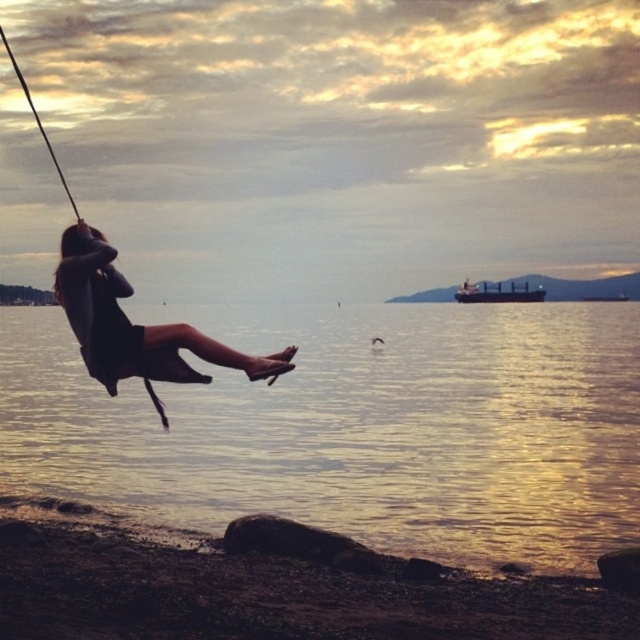
You are a photographer trying to capture the dark matte dress at center and the metallic gray cargo ship at right in a single frame. Which object will appear closer to the camera in the photo?

The dark matte dress at center will appear closer to the camera because it is in front of the metallic gray cargo ship at right.

You are standing at the point labeled point (480, 292) and want to walk towards the point labeled point (129, 374). According to the scene description, will you be moving towards the shoreline or away from it?

Since point (129, 374) is in front of point (480, 292), moving towards it would mean you are walking towards the shoreline.